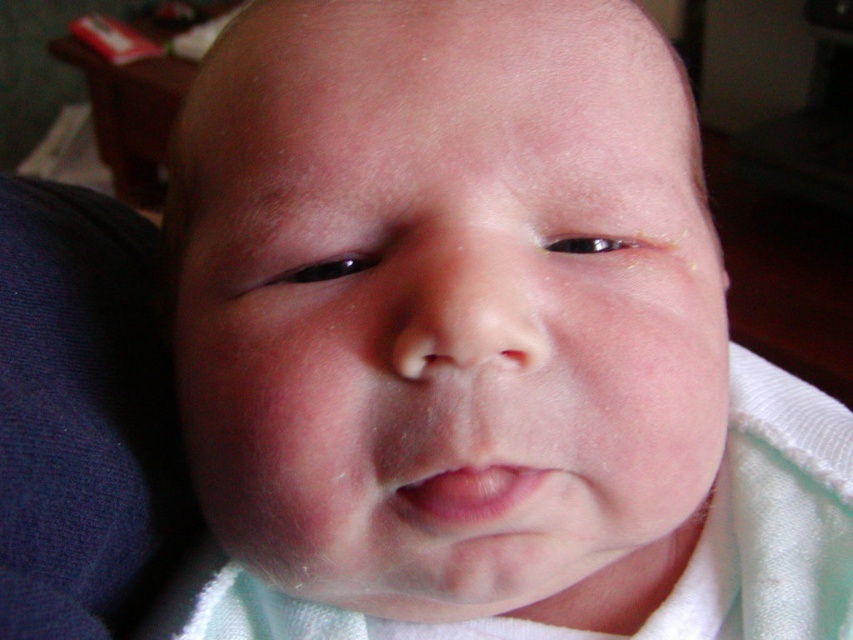
Question: Does smooth skin baby at center have a greater width compared to pink smooth lips at center?

Choices:
 (A) no
 (B) yes

Answer: (B)

Question: Which point is farther from the camera taking this photo?

Choices:
 (A) (689, 289)
 (B) (410, 508)

Answer: (A)

Question: Which of the following is the closest to the observer?

Choices:
 (A) (437, 477)
 (B) (614, 531)

Answer: (A)

Question: Is smooth skin baby at center positioned at the back of pink smooth lips at center?

Choices:
 (A) no
 (B) yes

Answer: (A)

Question: Is smooth skin baby at center positioned in front of pink smooth lips at center?

Choices:
 (A) yes
 (B) no

Answer: (A)